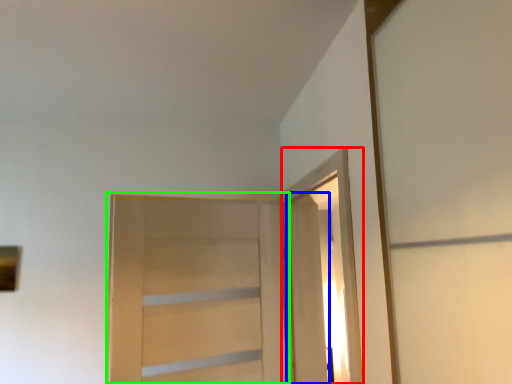
Question: Based on their relative distances, which object is nearer to elevator (highlighted by a red box)? Choose from door (highlighted by a blue box) and door (highlighted by a green box).

Choices:
 (A) door
 (B) door

Answer: (A)